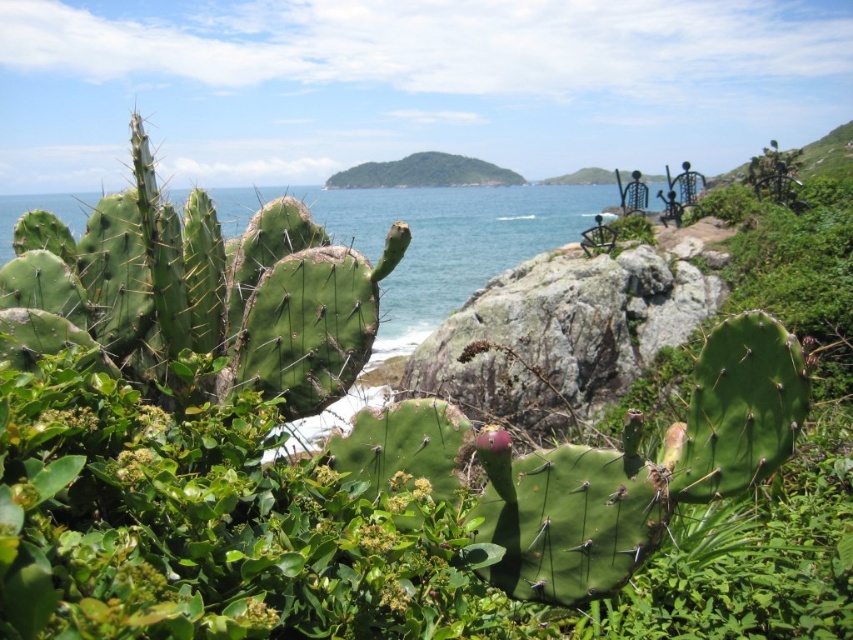
Question: Which object appears farthest from the camera in this image?

Choices:
 (A) rocky at center
 (B) green water at center

Answer: (A)

Question: Does rocky at center have a lesser width compared to green water at center?

Choices:
 (A) yes
 (B) no

Answer: (A)

Question: Is rocky at center to the right of green water at center from the viewer's perspective?

Choices:
 (A) no
 (B) yes

Answer: (B)

Question: Among these objects, which one is farthest from the camera?

Choices:
 (A) green water at center
 (B) rocky at center

Answer: (B)

Question: Which object appears closest to the camera in this image?

Choices:
 (A) green water at center
 (B) rocky at center

Answer: (A)

Question: Is rocky at center smaller than green water at center?

Choices:
 (A) yes
 (B) no

Answer: (A)